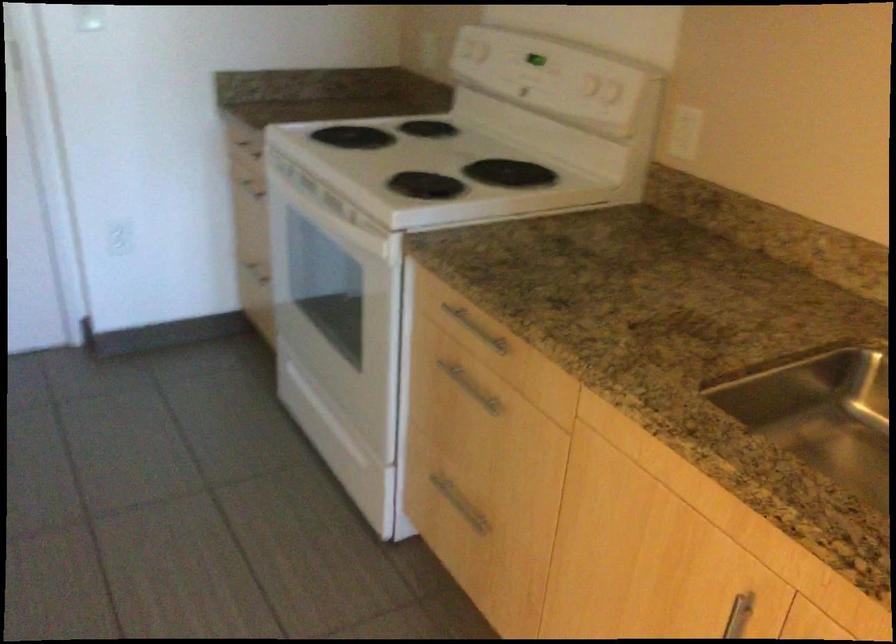
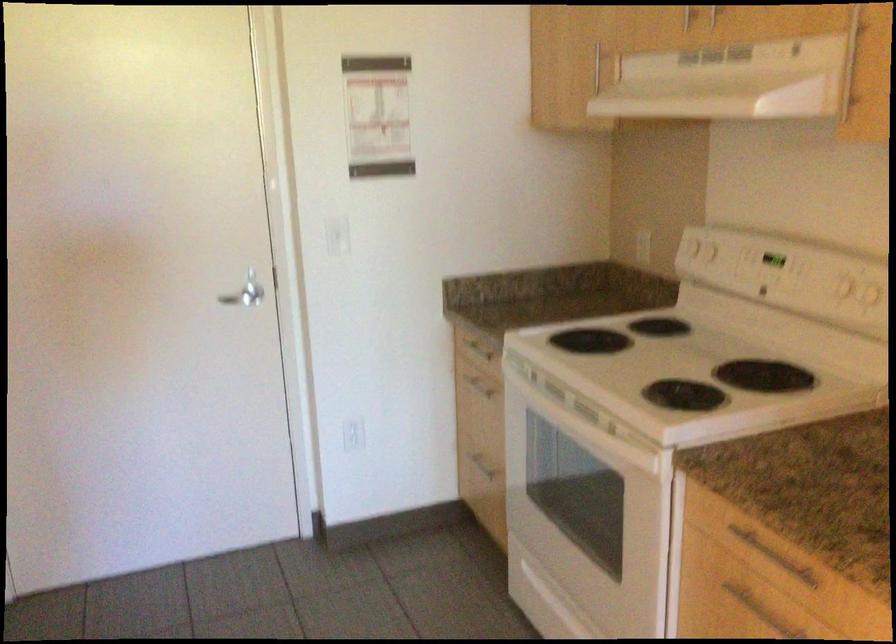
Find the pixel in the second image that matches (440,163) in the first image.

(686, 365)